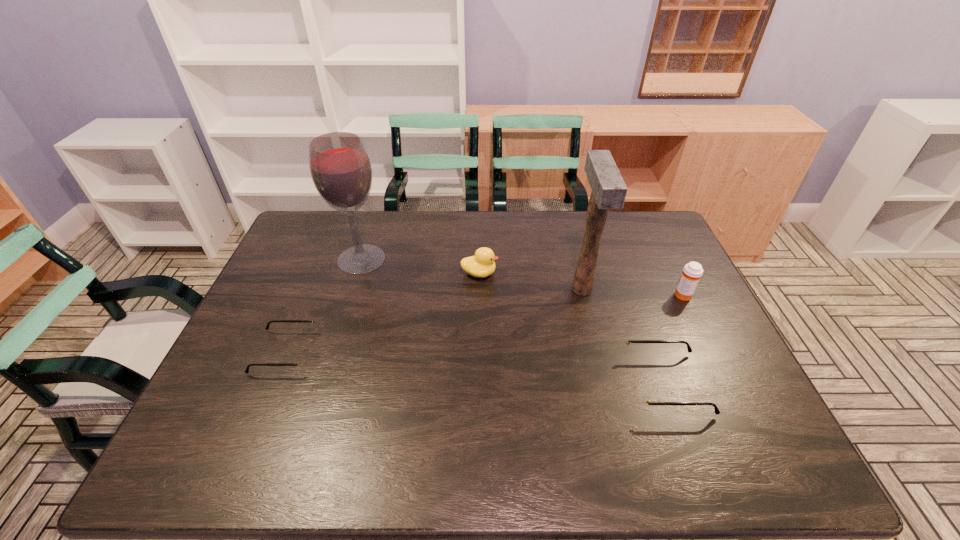
Image resolution: width=960 pixels, height=540 pixels. I want to click on free space that satisfies the following two spatial constraints: 1. on the beak of the duckling; 2. on the right side of the fourth shortest object, so click(x=479, y=295).